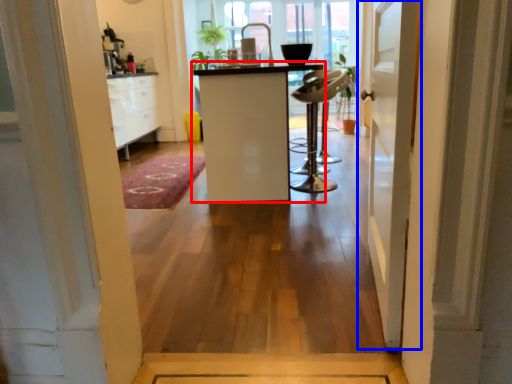
Question: Which point is further to the camera, furniture (highlighted by a red box) or door (highlighted by a blue box)?

Choices:
 (A) furniture
 (B) door

Answer: (A)